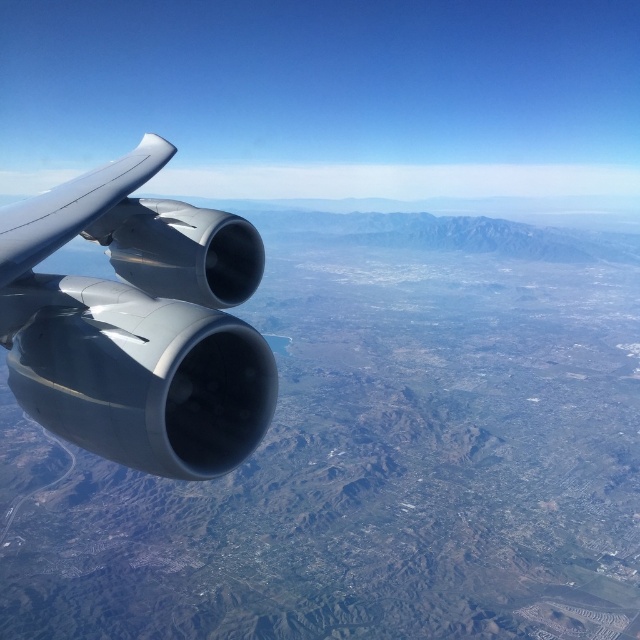
Question: Is matte gray engine at left to the right of satin silver wing at upper left from the viewer's perspective?

Choices:
 (A) yes
 (B) no

Answer: (A)

Question: Does matte gray engine at left have a greater width compared to satin silver wing at upper left?

Choices:
 (A) no
 (B) yes

Answer: (A)

Question: Which object is closer to the camera taking this photo?

Choices:
 (A) satin silver wing at upper left
 (B) matte gray engine at left

Answer: (B)

Question: Can you confirm if matte gray engine at left is wider than satin silver wing at upper left?

Choices:
 (A) yes
 (B) no

Answer: (B)

Question: Which point is closer to the camera?

Choices:
 (A) (29, 237)
 (B) (268, 348)

Answer: (A)